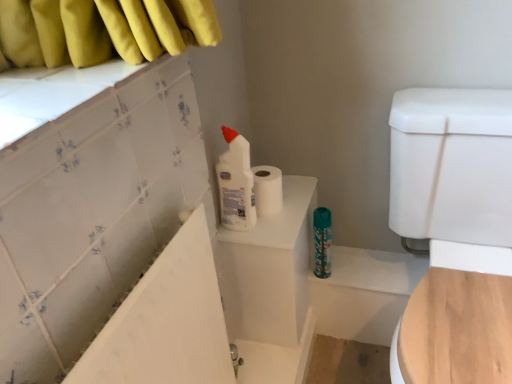
Where is `unoccupied region to the right of white matte toilet paper at upper center`? unoccupied region to the right of white matte toilet paper at upper center is located at coordinates (300, 198).